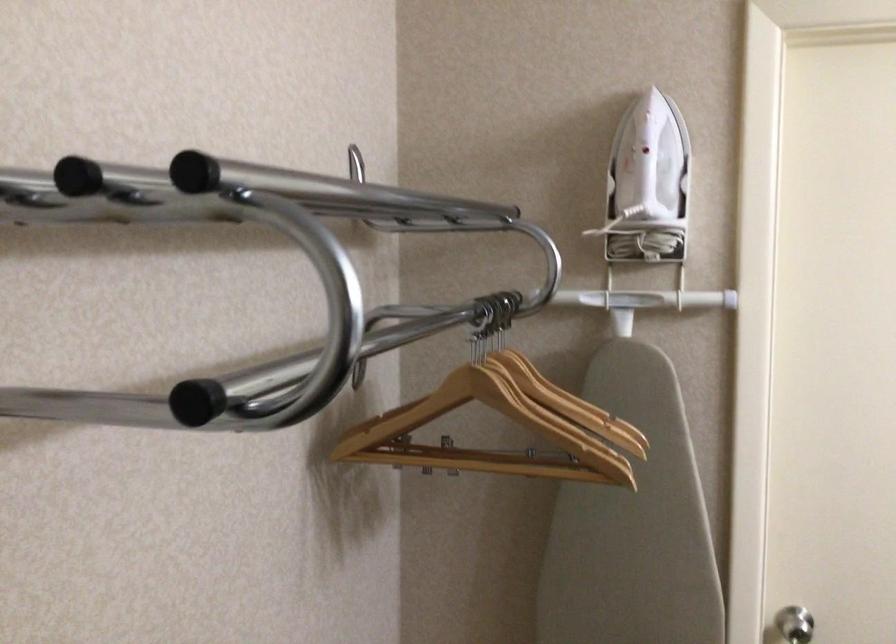
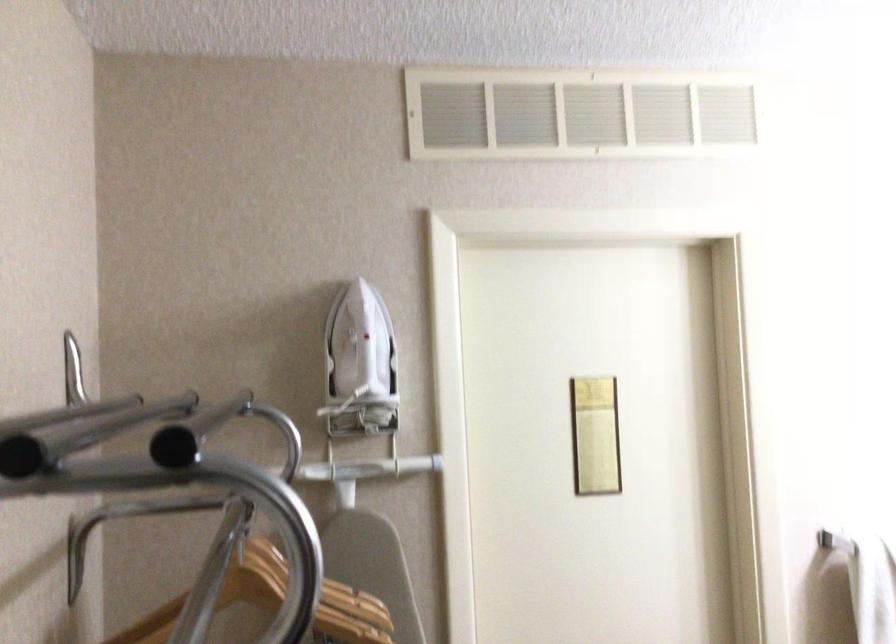
Question: The camera is either moving clockwise (left) or counter-clockwise (right) around the object. The first image is from the beginning of the video and the second image is from the end. Is the camera moving left or right when shooting the video?

Choices:
 (A) Left
 (B) Right

Answer: (A)